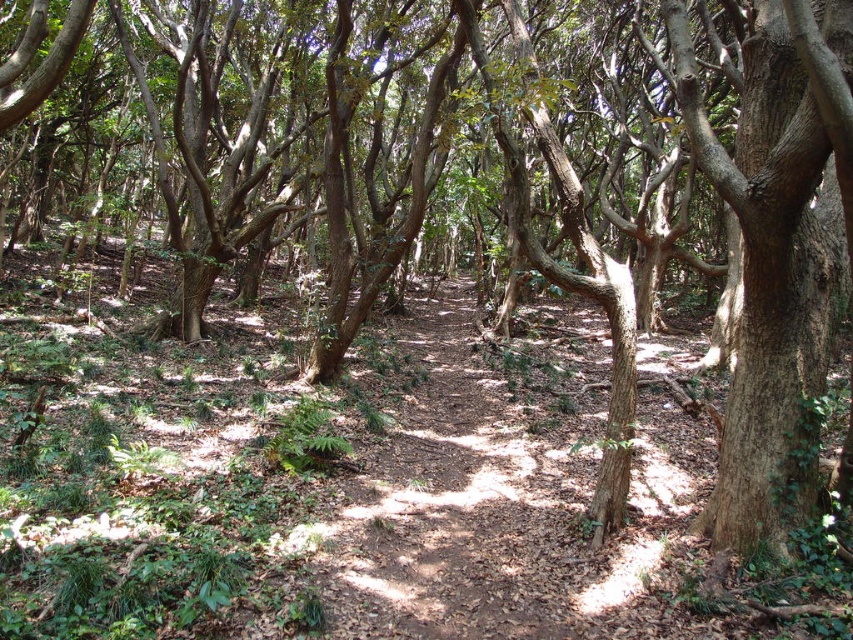
Is brown dirt trail at center positioned at the back of brown rough bark tree at right?

Yes, it is.

Can you confirm if brown dirt trail at center is taller than brown rough bark tree at right?

Incorrect, brown dirt trail at center's height is not larger of brown rough bark tree at right's.

Which is behind, point (640, 624) or point (820, 22)?

Positioned behind is point (640, 624).

The image size is (853, 640). In order to click on brown dirt trail at center in this screenshot , I will do `click(486, 512)`.